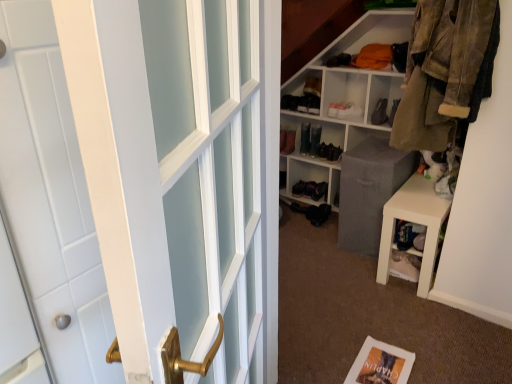
Question: Do you think matte black boot at upper center, which ranks as the 2th shoe in right-to-left order, is within camouflage fabric jacket at upper right, or outside of it?

Choices:
 (A) inside
 (B) outside

Answer: (B)

Question: Is point (360, 107) positioned closer to the camera than point (414, 97)?

Choices:
 (A) farther
 (B) closer

Answer: (A)

Question: Based on their relative distances, which object is farther from the brown suede shoe at center, which is counted as the fourth shoe, starting from the left?

Choices:
 (A) white cube shelf at upper right
 (B) white matte bookshelf at center
 (C) shiny black shoe at center, which ranks as the first shoe in left-to-right order
 (D) matte black boot at upper center, placed as the 3th shoe when sorted from left to right
 (E) white matte stool at lower right

Answer: (E)

Question: Which is farther from the shiny black boot at center, marked as the third shoe in a right-to-left arrangement?

Choices:
 (A) white matte bookshelf at center
 (B) brown suede shoe at center, which appears as the first shoe when viewed from the right
 (C) matte black boot at upper center, which ranks as the 2th shoe in right-to-left order
 (D) shiny black shoe at center, which ranks as the first shoe in left-to-right order
 (E) camouflage fabric jacket at upper right

Answer: (E)